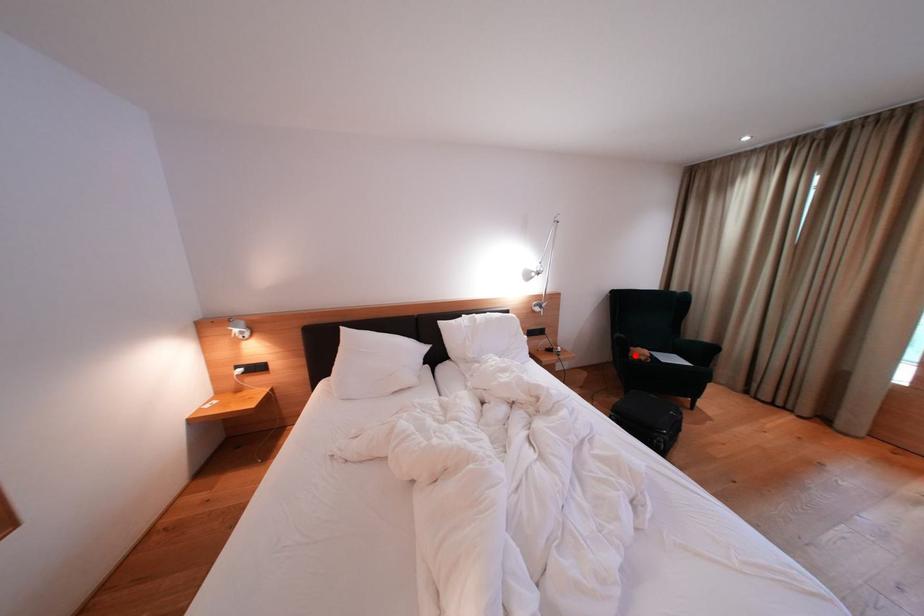
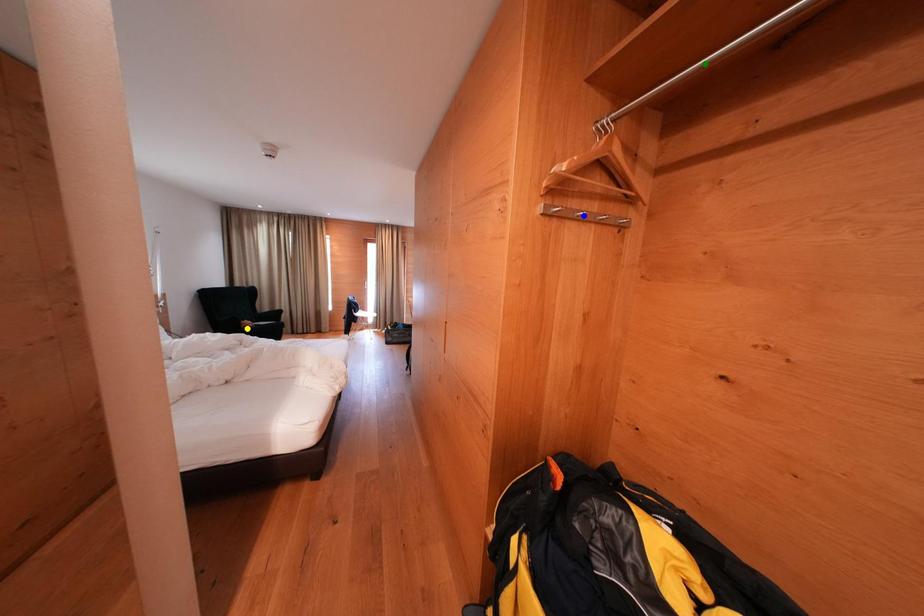
Question: I am providing you with two images of the same scene from different viewpoints. A red point is marked on the first image. You are given multiple points on the second image. Can you choose the point in image 2 that corresponds to the point in image 1?

Choices:
 (A) yellow point
 (B) blue point
 (C) green point

Answer: (A)